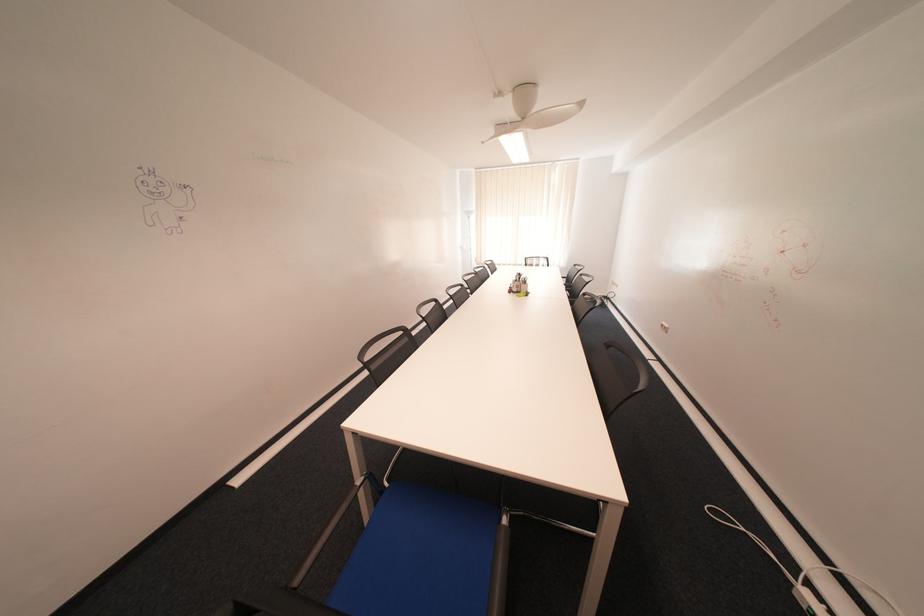
What do you see at coordinates (517, 286) in the screenshot?
I see `the pen holder` at bounding box center [517, 286].